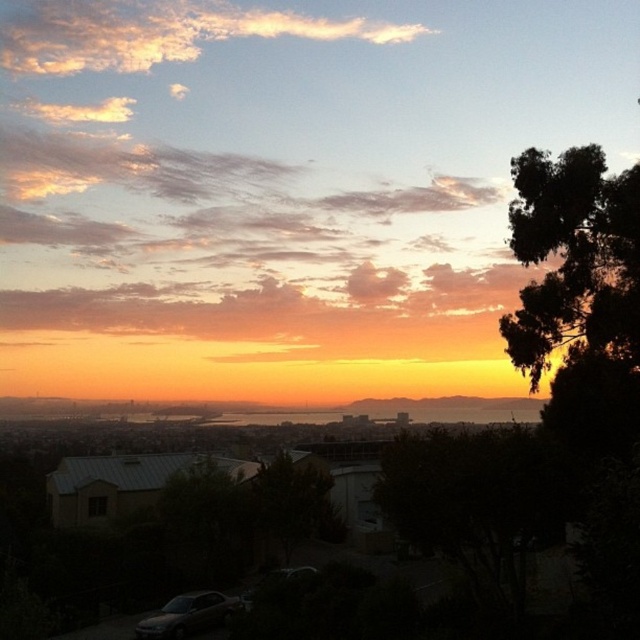
Find the location of a particular element. Image resolution: width=640 pixels, height=640 pixels. green leafy tree at center is located at coordinates (291, 506).